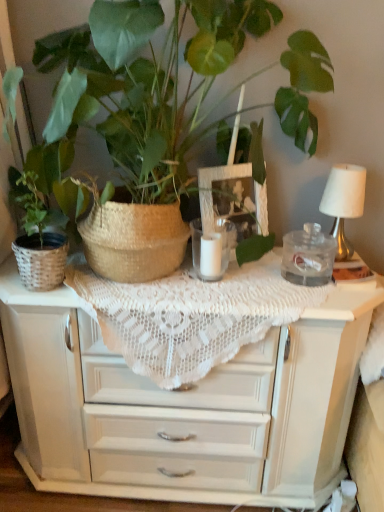
Question: From the image's perspective, is white lace tablecloth at center positioned above or below green woven basket at upper left, which is counted as the 2th houseplant, starting from the left?

Choices:
 (A) below
 (B) above

Answer: (A)

Question: Is white lace tablecloth at center inside or outside of green woven basket at upper left, which is counted as the 2th houseplant, starting from the left?

Choices:
 (A) outside
 (B) inside

Answer: (A)

Question: Which object is the closest to the green woven basket at upper left, the first houseplant when ordered from right to left?

Choices:
 (A) white fabric-covered lampshade at right
 (B) white lace tablecloth at center
 (C) clear glass jar at center
 (D) white glass candle at center
 (E) matte wicker basket at left, which ranks as the 1th houseplant in left-to-right order

Answer: (E)

Question: Considering the real-world distances, which object is farthest from the matte wicker basket at left, placed as the second houseplant when sorted from right to left?

Choices:
 (A) white glass candle at center
 (B) green woven basket at upper left, which is counted as the 2th houseplant, starting from the left
 (C) white fabric-covered lampshade at right
 (D) white lace tablecloth at center
 (E) clear glass jar at center

Answer: (C)